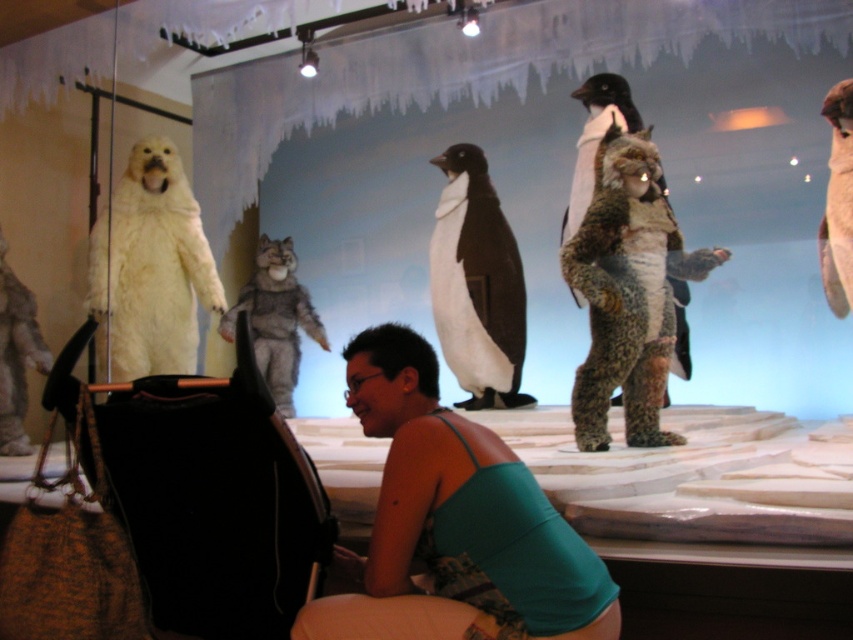
Question: Can you confirm if gray furry wolf at center is positioned to the left of white fluffy penguin at upper right?

Choices:
 (A) no
 (B) yes

Answer: (B)

Question: Estimate the real-world distances between objects in this image. Which object is farther from the fluffy fur penguin at center?

Choices:
 (A) teal fabric tank top at center
 (B) white fluffy penguin at upper right
 (C) black matte penguin at center

Answer: (A)

Question: Is gray furry wolf at center behind fluffy fur penguin at center?

Choices:
 (A) no
 (B) yes

Answer: (B)

Question: Observing the image, what is the correct spatial positioning of black matte penguin at center in reference to white fluffy penguin at upper right?

Choices:
 (A) right
 (B) left

Answer: (B)

Question: Which point is farther from the camera taking this photo?

Choices:
 (A) (395, 452)
 (B) (846, 97)

Answer: (B)

Question: Which point is farther from the camera taking this photo?

Choices:
 (A) (263, 301)
 (B) (625, 102)
 (C) (431, 497)
 (D) (834, 147)

Answer: (A)